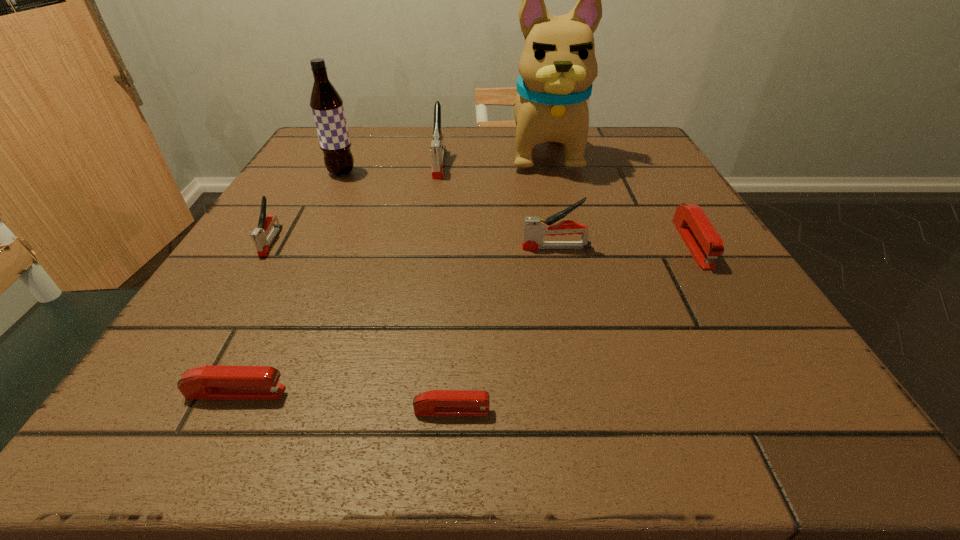
Find the location of `object that is at the right edge`. object that is at the right edge is located at coordinates click(x=704, y=243).

At what (x,y) coordinates should I click in order to perform the action: click on object present at the far left corner. Please return your answer as a coordinate pair (x, y). Image resolution: width=960 pixels, height=540 pixels. Looking at the image, I should click on (326, 104).

Locate an element on the screen. object at the near left corner is located at coordinates (209, 381).

The height and width of the screenshot is (540, 960). What are the coordinates of `blank space at the far edge of the desktop` in the screenshot? It's located at (396, 157).

Locate an element on the screen. The image size is (960, 540). free region at the near edge is located at coordinates (588, 431).

Where is `free space at the left edge of the desktop`? The image size is (960, 540). free space at the left edge of the desktop is located at coordinates click(346, 196).

Find the location of `blank area at the right edge`. blank area at the right edge is located at coordinates (628, 202).

Where is `free point at the far right corner`? free point at the far right corner is located at coordinates (652, 170).

Where is `vacant space that is in between the beige puppy and the leftmost stapler`? The height and width of the screenshot is (540, 960). vacant space that is in between the beige puppy and the leftmost stapler is located at coordinates (408, 196).

Identify the location of vacant area that lies between the root beer and the rightmost object. (516, 208).